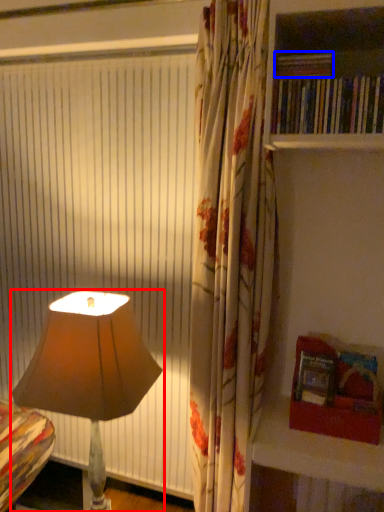
Question: Which of the following is the farthest to the observer, lamp (highlighted by a red box) or book (highlighted by a blue box)?

Choices:
 (A) lamp
 (B) book

Answer: (A)